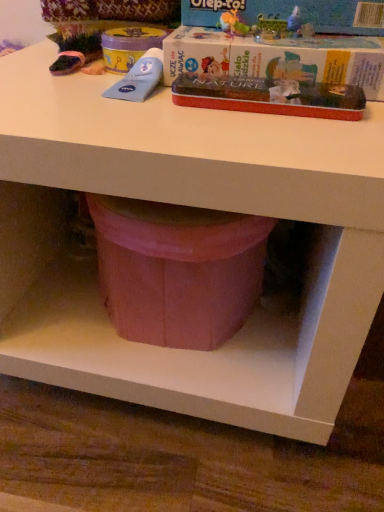
The width and height of the screenshot is (384, 512). What do you see at coordinates (270, 96) in the screenshot?
I see `metallic red tin at upper center, the 1th paperback book positioned from the bottom` at bounding box center [270, 96].

At what (x,y) coordinates should I click in order to perform the action: click on matte cardboard box at upper center, which appears as the first paperback book when viewed from the top. Please return your answer as a coordinate pair (x, y). This screenshot has width=384, height=512. Looking at the image, I should click on (291, 11).

Find the location of a particular element. Image resolution: width=384 pixels, height=512 pixels. metallic red tin at upper center, the 1th paperback book positioned from the bottom is located at coordinates (x=270, y=96).

From the image's perspective, which one is positioned higher, matte cardboard box at upper center, the third paperback book from the bottom, or metallic red tin at upper center, the third paperback book positioned from the top?

matte cardboard box at upper center, the third paperback book from the bottom.

Considering the sizes of matte cardboard box at upper center, which appears as the first paperback book when viewed from the top, and metallic red tin at upper center, the 1th paperback book positioned from the bottom, in the image, is matte cardboard box at upper center, which appears as the first paperback book when viewed from the top, taller or shorter than metallic red tin at upper center, the 1th paperback book positioned from the bottom,?

Clearly, matte cardboard box at upper center, which appears as the first paperback book when viewed from the top, is taller compared to metallic red tin at upper center, the 1th paperback book positioned from the bottom.

Considering their positions, is matte cardboard box at upper center, which appears as the first paperback book when viewed from the top, located in front of or behind metallic red tin at upper center, the 1th paperback book positioned from the bottom?

matte cardboard box at upper center, which appears as the first paperback book when viewed from the top, is behind metallic red tin at upper center, the 1th paperback book positioned from the bottom.

Is matte cardboard box at upper center, which appears as the first paperback book when viewed from the top, positioned far away from metallic red tin at upper center, the third paperback book positioned from the top?

No, matte cardboard box at upper center, which appears as the first paperback book when viewed from the top, is not far from metallic red tin at upper center, the third paperback book positioned from the top.

Is red cardboard box at upper center, which is the 2th paperback book from top to bottom, positioned with its back to metallic red tin at upper center, the 1th paperback book positioned from the bottom?

No, metallic red tin at upper center, the 1th paperback book positioned from the bottom, is not at the back of red cardboard box at upper center, which is the 2th paperback book from top to bottom.

From a real-world perspective, which is physically below, red cardboard box at upper center, which ranks as the second paperback book in bottom-to-top order, or metallic red tin at upper center, the third paperback book positioned from the top?

metallic red tin at upper center, the third paperback book positioned from the top, from a real-world perspective.

Is red cardboard box at upper center, which is the 2th paperback book from top to bottom, positioned in front of metallic red tin at upper center, the 1th paperback book positioned from the bottom?

No, red cardboard box at upper center, which is the 2th paperback book from top to bottom, is further to the viewer.

Does point (313, 62) appear closer or farther from the camera than point (324, 106)?

Point (313, 62) is positioned farther from the camera compared to point (324, 106).

Considering the positions of objects metallic red tin at upper center, the 1th paperback book positioned from the bottom, and red cardboard box at upper center, which is the 2th paperback book from top to bottom, in the image provided, who is behind, metallic red tin at upper center, the 1th paperback book positioned from the bottom, or red cardboard box at upper center, which is the 2th paperback book from top to bottom,?

Positioned behind is red cardboard box at upper center, which is the 2th paperback book from top to bottom.

Does metallic red tin at upper center, the third paperback book positioned from the top, have a lesser width compared to red cardboard box at upper center, which is the 2th paperback book from top to bottom?

Indeed, metallic red tin at upper center, the third paperback book positioned from the top, has a lesser width compared to red cardboard box at upper center, which is the 2th paperback book from top to bottom.

Which point is more forward, (328, 101) or (189, 72)?

The point (328, 101) is closer to the camera.

Considering the positions of objects metallic red tin at upper center, the 1th paperback book positioned from the bottom, and matte cardboard box at upper center, which appears as the first paperback book when viewed from the top, in the image provided, who is behind, metallic red tin at upper center, the 1th paperback book positioned from the bottom, or matte cardboard box at upper center, which appears as the first paperback book when viewed from the top,?

matte cardboard box at upper center, which appears as the first paperback book when viewed from the top, is more distant.

Which is in front, point (358, 115) or point (188, 3)?

The point (358, 115) is closer to the camera.

Can you tell me how much metallic red tin at upper center, the third paperback book positioned from the top, and matte cardboard box at upper center, the third paperback book from the bottom, differ in facing direction?

The angular difference between metallic red tin at upper center, the third paperback book positioned from the top, and matte cardboard box at upper center, the third paperback book from the bottom, is 0.00119 degrees.

Can you confirm if matte cardboard box at upper center, which appears as the first paperback book when viewed from the top, is positioned to the right of red cardboard box at upper center, which ranks as the second paperback book in bottom-to-top order?

Yes, matte cardboard box at upper center, which appears as the first paperback book when viewed from the top, is to the right of red cardboard box at upper center, which ranks as the second paperback book in bottom-to-top order.

Does matte cardboard box at upper center, the third paperback book from the bottom, have a larger size compared to red cardboard box at upper center, which is the 2th paperback book from top to bottom?

No, matte cardboard box at upper center, the third paperback book from the bottom, is not bigger than red cardboard box at upper center, which is the 2th paperback book from top to bottom.

Would you consider matte cardboard box at upper center, the third paperback book from the bottom, to be distant from red cardboard box at upper center, which ranks as the second paperback book in bottom-to-top order?

No, matte cardboard box at upper center, the third paperback book from the bottom, is not far away from red cardboard box at upper center, which ranks as the second paperback book in bottom-to-top order.

How far apart are matte cardboard box at upper center, which appears as the first paperback book when viewed from the top, and red cardboard box at upper center, which is the 2th paperback book from top to bottom?

They are 3.34 inches apart.

Identify the location of paperback book that appears on the right of red cardboard box at upper center, which is the 2th paperback book from top to bottom. Image resolution: width=384 pixels, height=512 pixels. (291, 11).

Is red cardboard box at upper center, which ranks as the second paperback book in bottom-to-top order, oriented away from matte cardboard box at upper center, which appears as the first paperback book when viewed from the top?

No, red cardboard box at upper center, which ranks as the second paperback book in bottom-to-top order, is not facing away from matte cardboard box at upper center, which appears as the first paperback book when viewed from the top.

Which is more to the right, red cardboard box at upper center, which ranks as the second paperback book in bottom-to-top order, or matte cardboard box at upper center, the third paperback book from the bottom?

Positioned to the right is matte cardboard box at upper center, the third paperback book from the bottom.

Considering the relative sizes of red cardboard box at upper center, which ranks as the second paperback book in bottom-to-top order, and matte cardboard box at upper center, which appears as the first paperback book when viewed from the top, in the image provided, is red cardboard box at upper center, which ranks as the second paperback book in bottom-to-top order, shorter than matte cardboard box at upper center, which appears as the first paperback book when viewed from the top,?

In fact, red cardboard box at upper center, which ranks as the second paperback book in bottom-to-top order, may be taller than matte cardboard box at upper center, which appears as the first paperback book when viewed from the top.

Image resolution: width=384 pixels, height=512 pixels. Find the location of `the 2nd paperback book to the right of the metallic red tin at upper center, the third paperback book positioned from the top, starting your count from the anchor`. the 2nd paperback book to the right of the metallic red tin at upper center, the third paperback book positioned from the top, starting your count from the anchor is located at coordinates (291, 11).

Identify the location of the 1st paperback book above when counting from the metallic red tin at upper center, the third paperback book positioned from the top (from the image's perspective). The image size is (384, 512). pyautogui.click(x=277, y=58).

Which object lies nearer to the anchor point metallic red tin at upper center, the 1th paperback book positioned from the bottom, matte cardboard box at upper center, the third paperback book from the bottom, or red cardboard box at upper center, which ranks as the second paperback book in bottom-to-top order?

The object closer to metallic red tin at upper center, the 1th paperback book positioned from the bottom, is red cardboard box at upper center, which ranks as the second paperback book in bottom-to-top order.

Estimate the real-world distances between objects in this image. Which object is further from red cardboard box at upper center, which is the 2th paperback book from top to bottom, matte cardboard box at upper center, which appears as the first paperback book when viewed from the top, or metallic red tin at upper center, the third paperback book positioned from the top?

matte cardboard box at upper center, which appears as the first paperback book when viewed from the top.

Looking at the image, which one is located closer to red cardboard box at upper center, which is the 2th paperback book from top to bottom, metallic red tin at upper center, the 1th paperback book positioned from the bottom, or matte cardboard box at upper center, the third paperback book from the bottom?

Based on the image, metallic red tin at upper center, the 1th paperback book positioned from the bottom, appears to be nearer to red cardboard box at upper center, which is the 2th paperback book from top to bottom.

Estimate the real-world distances between objects in this image. Which object is further from metallic red tin at upper center, the 1th paperback book positioned from the bottom, red cardboard box at upper center, which ranks as the second paperback book in bottom-to-top order, or matte cardboard box at upper center, the third paperback book from the bottom?

matte cardboard box at upper center, the third paperback book from the bottom, is further to metallic red tin at upper center, the 1th paperback book positioned from the bottom.

Which object lies nearer to the anchor point matte cardboard box at upper center, which appears as the first paperback book when viewed from the top, metallic red tin at upper center, the 1th paperback book positioned from the bottom, or red cardboard box at upper center, which ranks as the second paperback book in bottom-to-top order?

red cardboard box at upper center, which ranks as the second paperback book in bottom-to-top order, lies closer to matte cardboard box at upper center, which appears as the first paperback book when viewed from the top, than the other object.

Estimate the real-world distances between objects in this image. Which object is closer to matte cardboard box at upper center, which appears as the first paperback book when viewed from the top, red cardboard box at upper center, which is the 2th paperback book from top to bottom, or metallic red tin at upper center, the third paperback book positioned from the top?

red cardboard box at upper center, which is the 2th paperback book from top to bottom.

Locate an element on the screen. The width and height of the screenshot is (384, 512). paperback book between matte cardboard box at upper center, the third paperback book from the bottom, and metallic red tin at upper center, the 1th paperback book positioned from the bottom, from top to bottom is located at coordinates (277, 58).